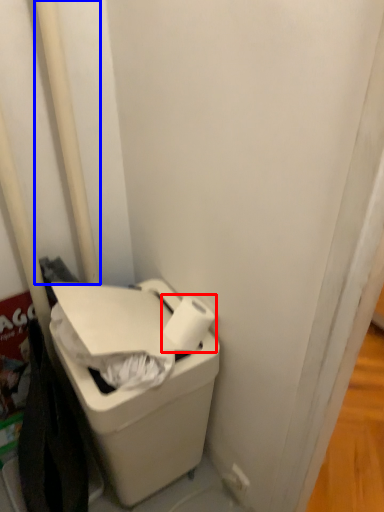
Question: Which object is further to the camera taking this photo, toilet paper (highlighted by a red box) or pole (highlighted by a blue box)?

Choices:
 (A) toilet paper
 (B) pole

Answer: (A)